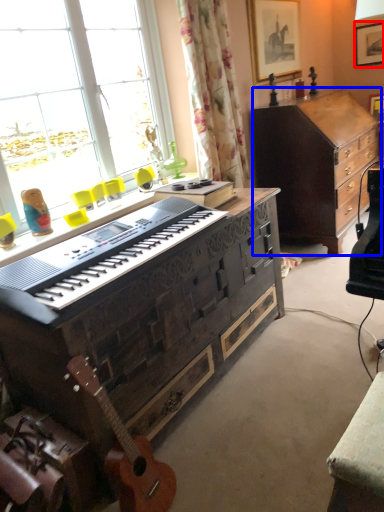
Question: Which of the following is the closest to the observer, picture frame (highlighted by a red box) or cabinetry (highlighted by a blue box)?

Choices:
 (A) picture frame
 (B) cabinetry

Answer: (B)